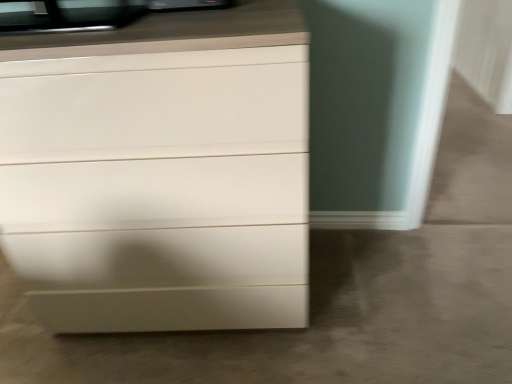
Question: Should I look upward or downward to see matte white chest of drawers at lower left?

Choices:
 (A) up
 (B) down

Answer: (A)